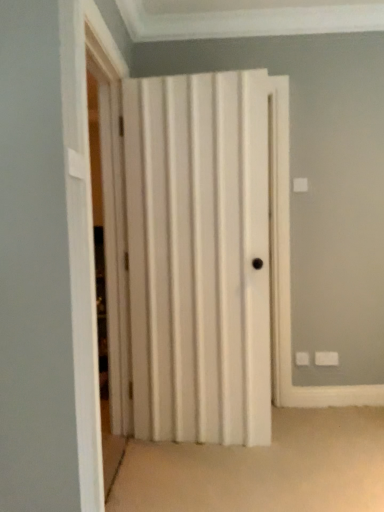
Question: Would you say white wood folding door at center is inside or outside white matte door at center?

Choices:
 (A) outside
 (B) inside

Answer: (A)

Question: In terms of width, does white wood folding door at center look wider or thinner when compared to white matte door at center?

Choices:
 (A) thin
 (B) wide

Answer: (A)

Question: From the image's perspective, relative to white matte door at center, is white wood folding door at center above or below?

Choices:
 (A) below
 (B) above

Answer: (B)

Question: Is white matte door at center bigger or smaller than white wood folding door at center?

Choices:
 (A) small
 (B) big

Answer: (B)

Question: From a real-world perspective, is white matte door at center above or below white wood folding door at center?

Choices:
 (A) above
 (B) below

Answer: (B)

Question: Considering the positions of white matte door at center and white wood folding door at center in the image, is white matte door at center wider or thinner than white wood folding door at center?

Choices:
 (A) thin
 (B) wide

Answer: (B)

Question: From the image's perspective, relative to white wood folding door at center, is white matte door at center above or below?

Choices:
 (A) below
 (B) above

Answer: (A)